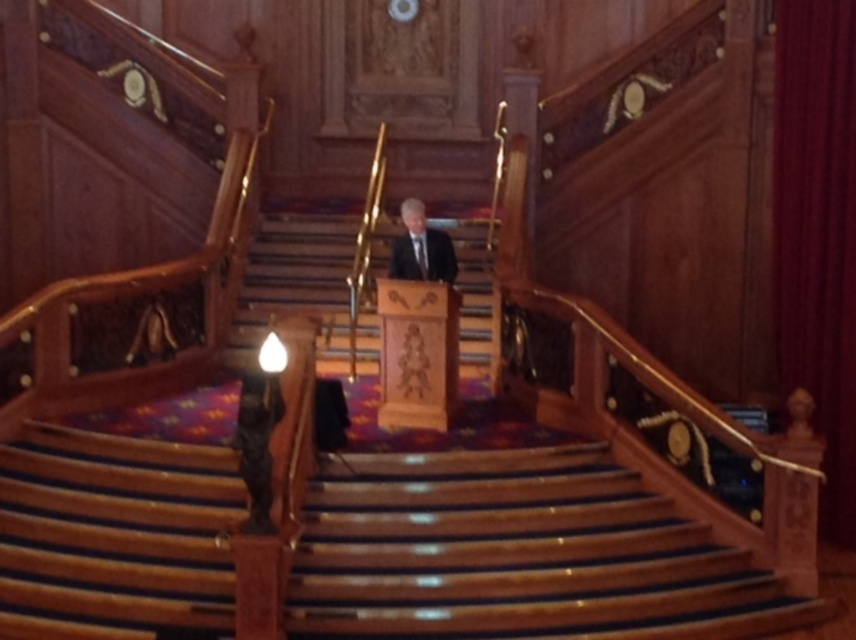
Does dark red velvet curtain at upper center have a smaller size compared to wooden podium at center?

Yes, dark red velvet curtain at upper center is smaller than wooden podium at center.

Can you confirm if dark red velvet curtain at upper center is positioned below wooden podium at center?

Actually, dark red velvet curtain at upper center is above wooden podium at center.

Where is `dark red velvet curtain at upper center`? The image size is (856, 640). dark red velvet curtain at upper center is located at coordinates (817, 232).

Is point (340, 346) closer to viewer compared to point (401, 262)?

No, it is not.

Find the location of `wooden podium at center`. wooden podium at center is located at coordinates (296, 284).

Does point (477, 280) come behind point (420, 205)?

Yes, point (477, 280) is farther from viewer.

Identify the location of wooden podium at center. (296, 284).

Can you confirm if wooden stairs at center is positioned to the right of dark red velvet curtain at upper center?

No, wooden stairs at center is not to the right of dark red velvet curtain at upper center.

Between point (328, 561) and point (842, 12), which one is positioned behind?

The point (842, 12) is behind.

The image size is (856, 640). What are the coordinates of `wooden stairs at center` in the screenshot? It's located at (516, 554).